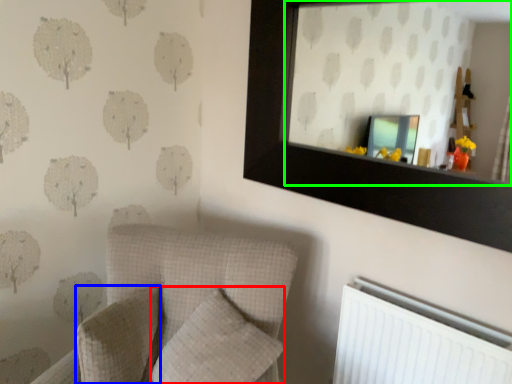
Question: Which object is the closest to the pillow (highlighted by a red box)? Choose among these: pillow (highlighted by a blue box) or mirror (highlighted by a green box).

Choices:
 (A) pillow
 (B) mirror

Answer: (A)